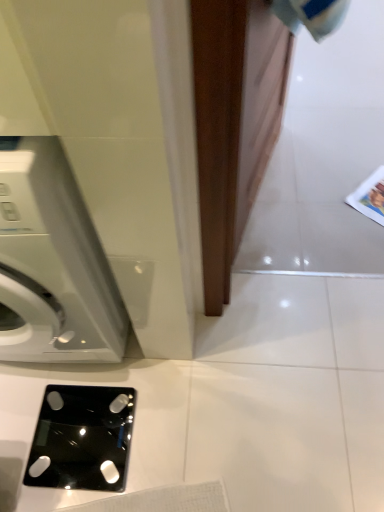
Question: Considering the positions of black glass scale at lower center and white glossy washing machine at left in the image, is black glass scale at lower center taller or shorter than white glossy washing machine at left?

Choices:
 (A) tall
 (B) short

Answer: (B)

Question: Is black glass scale at lower center bigger or smaller than white glossy washing machine at left?

Choices:
 (A) small
 (B) big

Answer: (A)

Question: From a real-world perspective, is black glass scale at lower center above or below white glossy washing machine at left?

Choices:
 (A) below
 (B) above

Answer: (A)

Question: From the image's perspective, is white glossy washing machine at left located above or below black glass scale at lower center?

Choices:
 (A) above
 (B) below

Answer: (A)

Question: From their relative heights in the image, would you say white glossy washing machine at left is taller or shorter than black glass scale at lower center?

Choices:
 (A) tall
 (B) short

Answer: (A)

Question: Choose the correct answer: Is white glossy washing machine at left inside black glass scale at lower center or outside it?

Choices:
 (A) outside
 (B) inside

Answer: (A)

Question: Considering the positions of white glossy washing machine at left and black glass scale at lower center in the image, is white glossy washing machine at left bigger or smaller than black glass scale at lower center?

Choices:
 (A) small
 (B) big

Answer: (B)